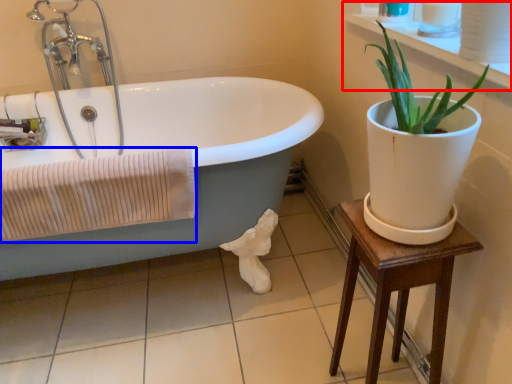
Question: Which object appears farthest to the camera in this image, window sill (highlighted by a red box) or bath towel (highlighted by a blue box)?

Choices:
 (A) window sill
 (B) bath towel

Answer: (B)